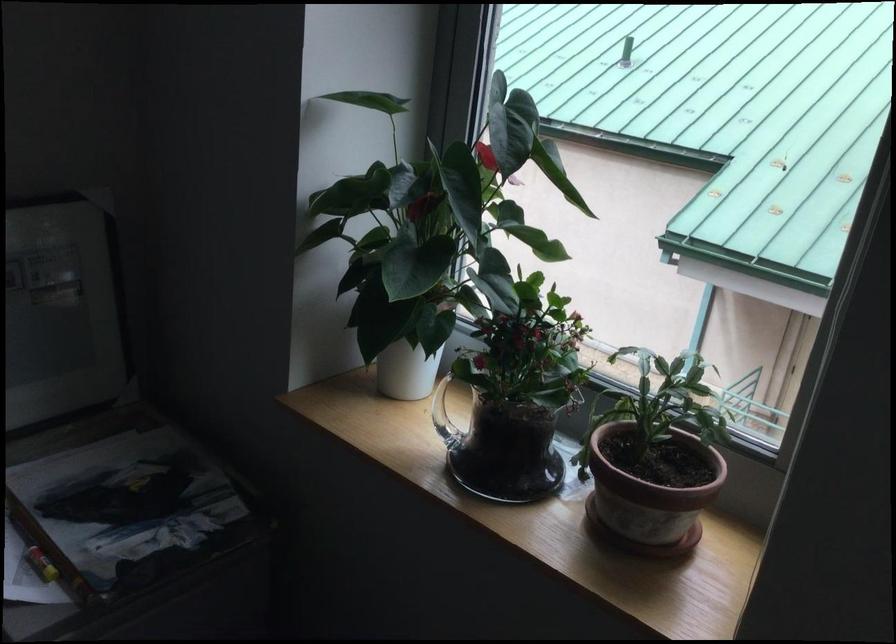
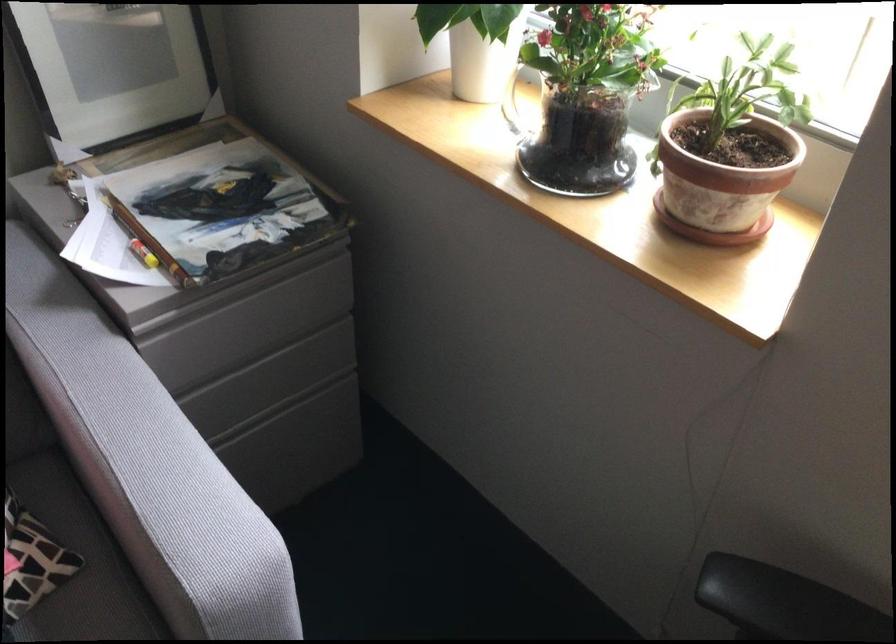
Where in the second image is the point corresponding to the point at 655,500 from the first image?

(721, 184)